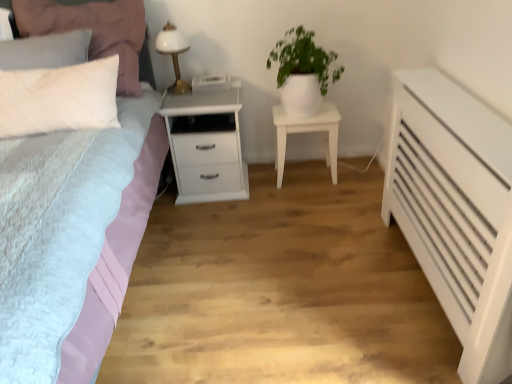
Where is `unoccupied area in front of white glossy nightstand at center, which appears as the second nightstand when viewed from the right`? Image resolution: width=512 pixels, height=384 pixels. unoccupied area in front of white glossy nightstand at center, which appears as the second nightstand when viewed from the right is located at coordinates tap(226, 228).